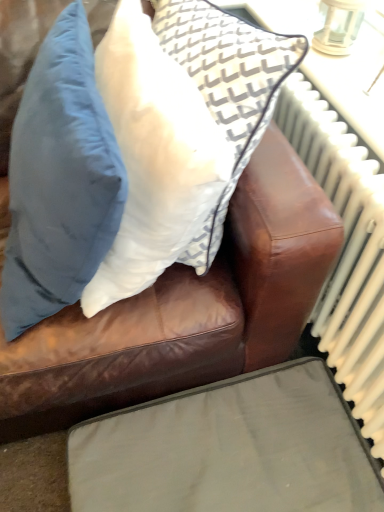
Question: In which direction should I rotate to look at white fabric pillow at upper center, the first pillow viewed from the right?

Choices:
 (A) right
 (B) left

Answer: (B)

Question: Is matte blue pillow at upper left, the first pillow from the left, directly adjacent to matte gray cushion at lower center?

Choices:
 (A) no
 (B) yes

Answer: (A)

Question: From the image's perspective, is matte blue pillow at upper left, placed as the 2th pillow when sorted from right to left, located beneath matte gray cushion at lower center?

Choices:
 (A) yes
 (B) no

Answer: (B)

Question: From a real-world perspective, is matte blue pillow at upper left, placed as the 2th pillow when sorted from right to left, below matte gray cushion at lower center?

Choices:
 (A) no
 (B) yes

Answer: (A)

Question: Does matte blue pillow at upper left, the first pillow from the left, have a lesser height compared to matte gray cushion at lower center?

Choices:
 (A) yes
 (B) no

Answer: (B)

Question: Is matte blue pillow at upper left, placed as the 2th pillow when sorted from right to left, smaller than matte gray cushion at lower center?

Choices:
 (A) no
 (B) yes

Answer: (A)

Question: Considering the relative sizes of matte blue pillow at upper left, placed as the 2th pillow when sorted from right to left, and matte gray cushion at lower center in the image provided, is matte blue pillow at upper left, placed as the 2th pillow when sorted from right to left, bigger than matte gray cushion at lower center?

Choices:
 (A) yes
 (B) no

Answer: (A)

Question: Would you say white metallic radiator at right is outside matte blue pillow at upper left, the first pillow from the left?

Choices:
 (A) no
 (B) yes

Answer: (B)

Question: From the image's perspective, is white metallic radiator at right below matte blue pillow at upper left, the first pillow from the left?

Choices:
 (A) yes
 (B) no

Answer: (A)

Question: Is white metallic radiator at right far away from matte blue pillow at upper left, the first pillow from the left?

Choices:
 (A) no
 (B) yes

Answer: (A)

Question: Is white metallic radiator at right taller than matte blue pillow at upper left, the first pillow from the left?

Choices:
 (A) yes
 (B) no

Answer: (B)

Question: Does white metallic radiator at right have a greater width compared to matte blue pillow at upper left, placed as the 2th pillow when sorted from right to left?

Choices:
 (A) yes
 (B) no

Answer: (B)

Question: Is white metallic radiator at right positioned before matte blue pillow at upper left, placed as the 2th pillow when sorted from right to left?

Choices:
 (A) no
 (B) yes

Answer: (A)

Question: From the image's perspective, would you say matte gray cushion at lower center is shown under white fabric pillow at upper center, the first pillow viewed from the right?

Choices:
 (A) yes
 (B) no

Answer: (A)